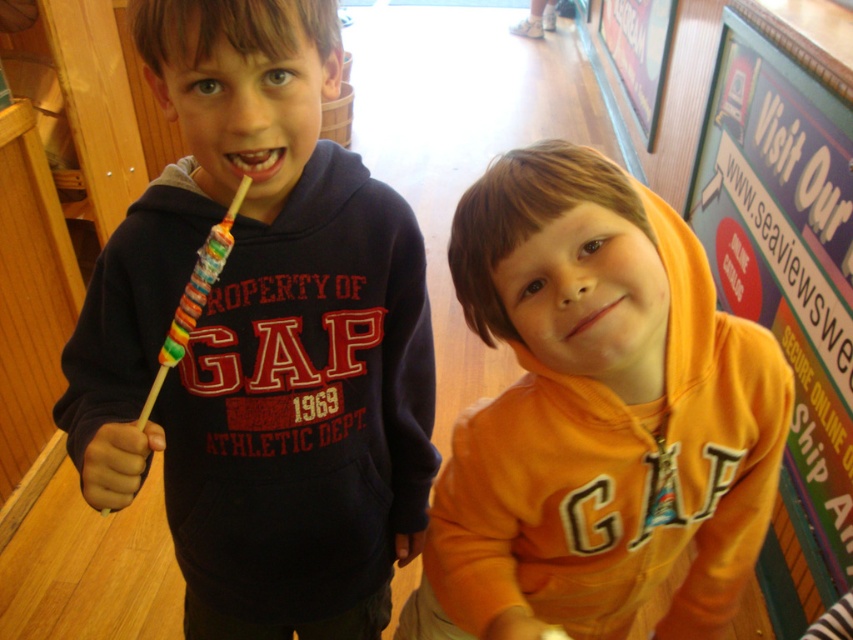
Question: Which point is closer to the camera taking this photo?

Choices:
 (A) (245, 588)
 (B) (527, 611)
 (C) (271, 170)

Answer: (C)

Question: Does rainbow candy lollipop at left lie behind pink matte lips at center?

Choices:
 (A) no
 (B) yes

Answer: (B)

Question: Which point is closer to the camera?

Choices:
 (A) click(399, 428)
 (B) click(567, 339)

Answer: (B)

Question: Considering the relative positions of matte plastic sign at upper right and pink matte lips at center in the image provided, where is matte plastic sign at upper right located with respect to pink matte lips at center?

Choices:
 (A) below
 (B) above

Answer: (B)

Question: Which object is closer to the camera taking this photo?

Choices:
 (A) pink matte lips at center
 (B) matte plastic sign at upper right

Answer: (A)

Question: From the image, what is the correct spatial relationship of orange fleece hoodie at center in relation to matte plastic sign at upper right?

Choices:
 (A) left
 (B) right

Answer: (A)